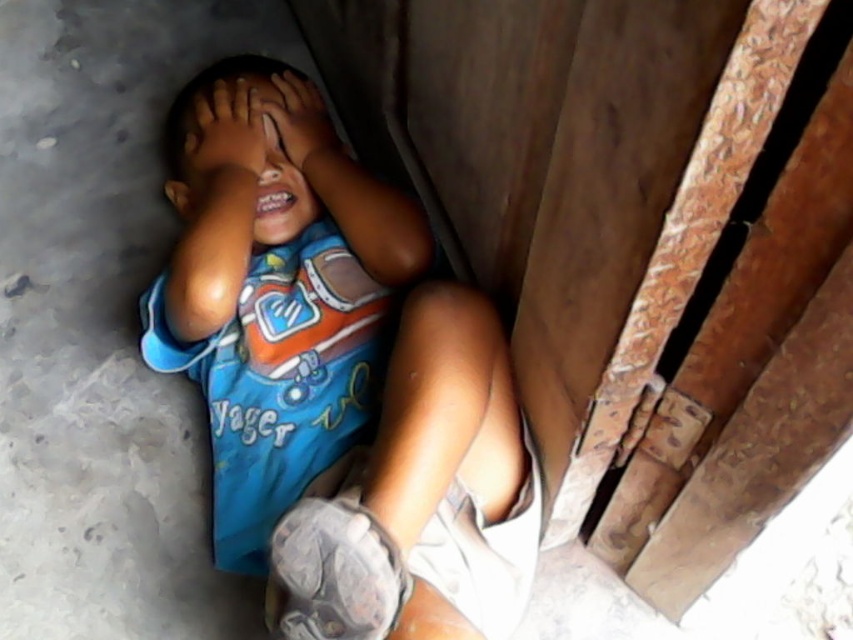
Question: In this image, where is blue cotton shirt at center located relative to matte skin hand at center?

Choices:
 (A) above
 (B) below

Answer: (B)

Question: Which point is closer to the camera?

Choices:
 (A) blue cotton shirt at center
 (B) smooth skin hand at center
 (C) brown matte eye at center
 (D) blue fabric head at center

Answer: (A)

Question: Does blue cotton shirt at center appear on the left side of smooth skin hand at center?

Choices:
 (A) yes
 (B) no

Answer: (B)

Question: Which object appears farthest from the camera in this image?

Choices:
 (A) matte skin hand at center
 (B) brown matte eye at center
 (C) smooth skin hand at center

Answer: (B)

Question: Can you confirm if matte skin hand at center is positioned to the left of brown matte eye at center?

Choices:
 (A) no
 (B) yes

Answer: (A)

Question: Estimate the real-world distances between objects in this image. Which object is farther from the matte skin hand at center?

Choices:
 (A) smooth skin hand at center
 (B) blue cotton shirt at center
 (C) brown matte eye at center

Answer: (B)